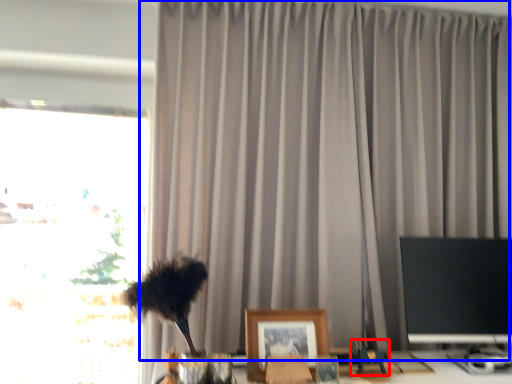
Question: Which object appears closest to the camera in this image, toy (highlighted by a red box) or curtain (highlighted by a blue box)?

Choices:
 (A) toy
 (B) curtain

Answer: (A)